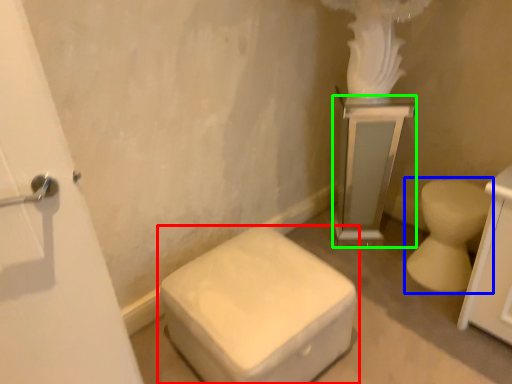
Question: Considering the real-world distances, which object is farthest from toilet (highlighted by a red box)? toilet (highlighted by a blue box) or medicine cabinet (highlighted by a green box)?

Choices:
 (A) toilet
 (B) medicine cabinet

Answer: (B)